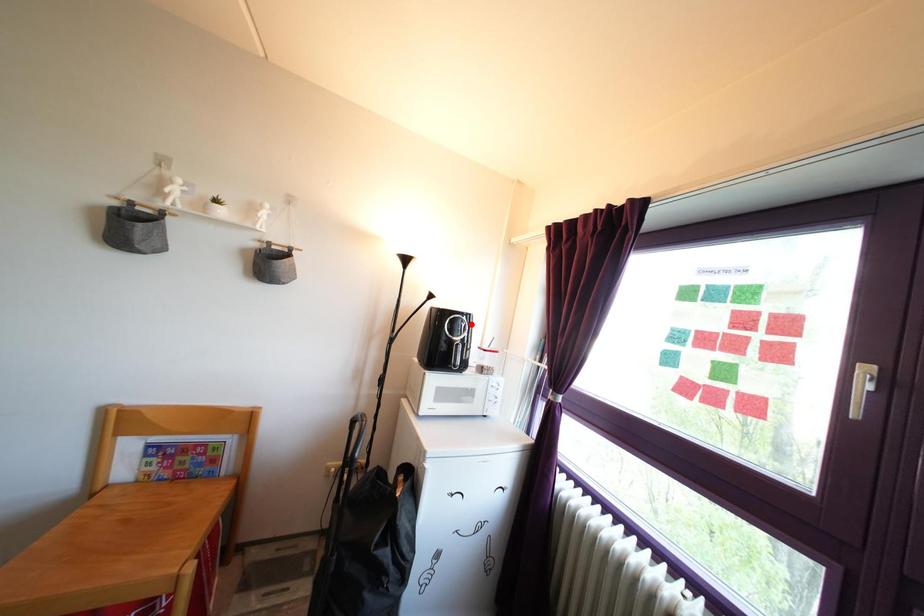
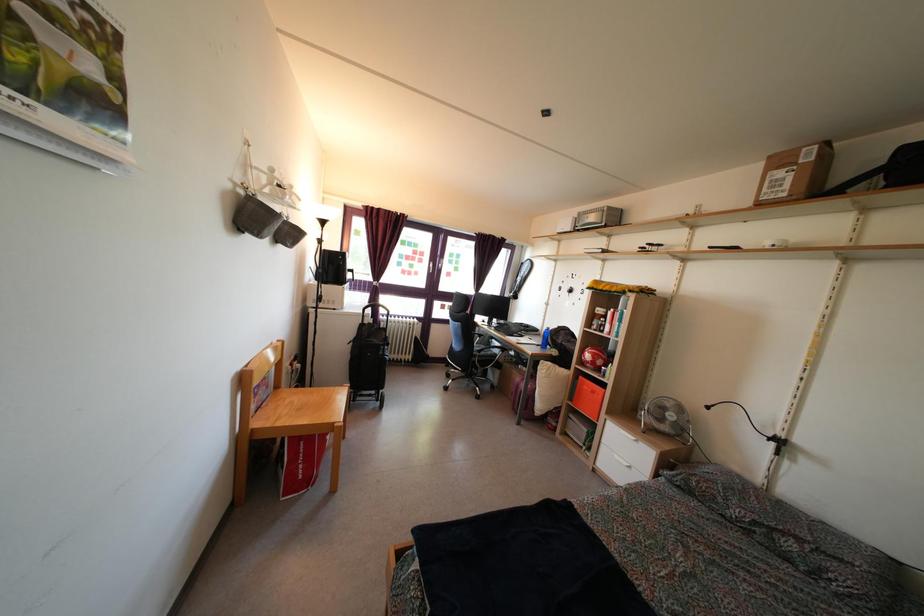
Question: I am providing you with two images of the same scene from different viewpoints. A red point is marked on the first image. Is the red point's position out of view in image 2?

Choices:
 (A) Yes
 (B) No

Answer: (A)